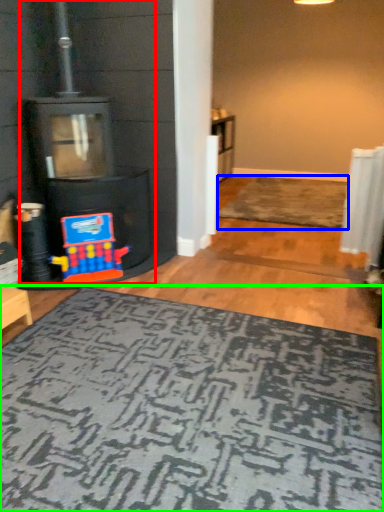
Question: Which object is the farthest from fireplace (highlighted by a red box)? Choose among these: doormat (highlighted by a blue box) or mat (highlighted by a green box).

Choices:
 (A) doormat
 (B) mat

Answer: (A)